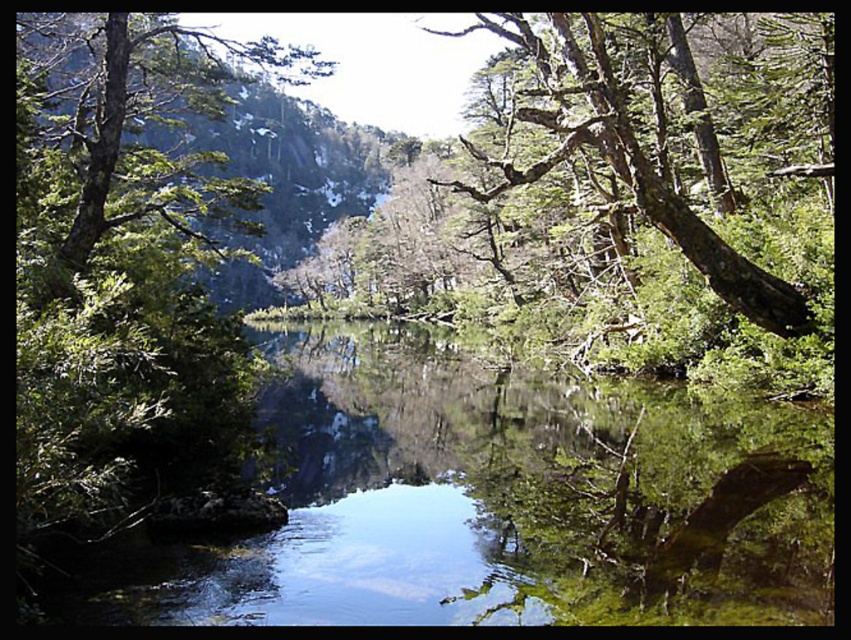
Question: Which point is closer to the camera?

Choices:
 (A) green bark tree at upper right
 (B) green leafy tree at upper left

Answer: (B)

Question: Which object is farther from the camera taking this photo?

Choices:
 (A) green bark tree at upper right
 (B) green leafy tree at upper left

Answer: (A)

Question: Is green leafy tree at upper left to the left of green bark tree at upper right from the viewer's perspective?

Choices:
 (A) no
 (B) yes

Answer: (B)

Question: Is green leafy tree at upper left thinner than green bark tree at upper right?

Choices:
 (A) no
 (B) yes

Answer: (A)

Question: Does green leafy tree at upper left have a smaller size compared to green bark tree at upper right?

Choices:
 (A) yes
 (B) no

Answer: (B)